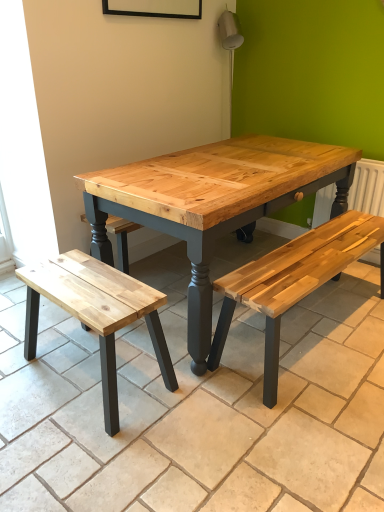
Find the location of `free space in front of natural wood bench at lower left`. free space in front of natural wood bench at lower left is located at coordinates (92, 450).